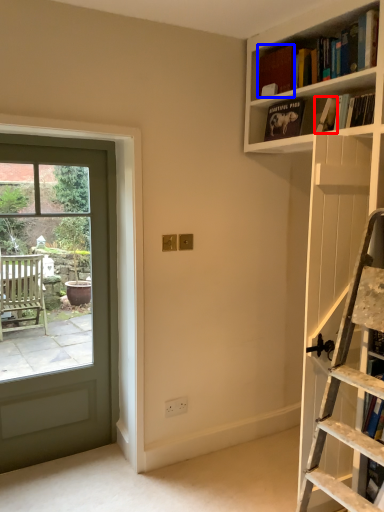
Question: Which of the following is the closest to the observer, book (highlighted by a red box) or book (highlighted by a blue box)?

Choices:
 (A) book
 (B) book

Answer: (A)